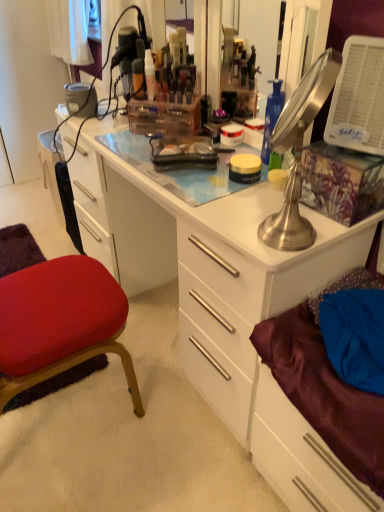
Where is `free space to the back side of metallic silver lamp at upper right`? free space to the back side of metallic silver lamp at upper right is located at coordinates (264, 203).